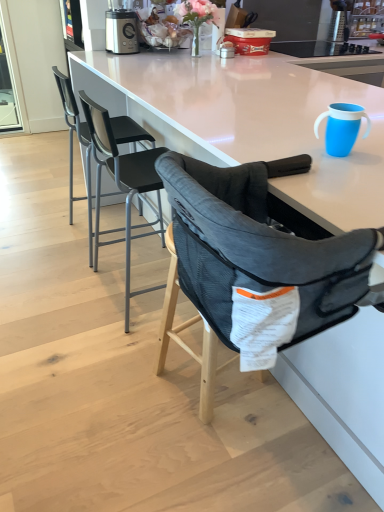
Question: Is black mesh chair at center, which is counted as the second chair, starting from the front, positioned in front of transparent glass screen door at upper left?

Choices:
 (A) no
 (B) yes

Answer: (B)

Question: Is black mesh chair at center, which is counted as the second chair, starting from the front, further to the viewer compared to transparent glass screen door at upper left?

Choices:
 (A) yes
 (B) no

Answer: (B)

Question: From a real-world perspective, does black mesh chair at center, which is counted as the second chair, starting from the front, sit lower than transparent glass screen door at upper left?

Choices:
 (A) yes
 (B) no

Answer: (A)

Question: From the image's perspective, is black mesh chair at center, the second chair in the back-to-front sequence, under transparent glass screen door at upper left?

Choices:
 (A) no
 (B) yes

Answer: (B)

Question: Can you confirm if black mesh chair at center, which is counted as the second chair, starting from the front, is taller than transparent glass screen door at upper left?

Choices:
 (A) yes
 (B) no

Answer: (B)

Question: From the image's perspective, does black mesh chair at center, the second chair in the back-to-front sequence, appear higher than transparent glass screen door at upper left?

Choices:
 (A) no
 (B) yes

Answer: (A)

Question: Is blue plastic cup at upper right outside black mesh chair at upper left, placed as the 3th chair when sorted from front to back?

Choices:
 (A) no
 (B) yes

Answer: (B)

Question: Is black mesh chair at upper left, the 1th chair from the back, surrounded by blue plastic cup at upper right?

Choices:
 (A) no
 (B) yes

Answer: (A)

Question: Is blue plastic cup at upper right bigger than black mesh chair at upper left, placed as the 3th chair when sorted from front to back?

Choices:
 (A) no
 (B) yes

Answer: (A)

Question: Could you tell me if blue plastic cup at upper right is facing black mesh chair at upper left, placed as the 3th chair when sorted from front to back?

Choices:
 (A) no
 (B) yes

Answer: (A)

Question: Considering the relative positions of blue plastic cup at upper right and black mesh chair at upper left, placed as the 3th chair when sorted from front to back, in the image provided, is blue plastic cup at upper right to the left of black mesh chair at upper left, placed as the 3th chair when sorted from front to back, from the viewer's perspective?

Choices:
 (A) no
 (B) yes

Answer: (A)

Question: Can you confirm if blue plastic cup at upper right is taller than black mesh chair at upper left, the 1th chair from the back?

Choices:
 (A) no
 (B) yes

Answer: (A)

Question: Could you tell me if blue plastic cup at upper right is turned towards black mesh chair at center, which is counted as the second chair, starting from the front?

Choices:
 (A) no
 (B) yes

Answer: (A)